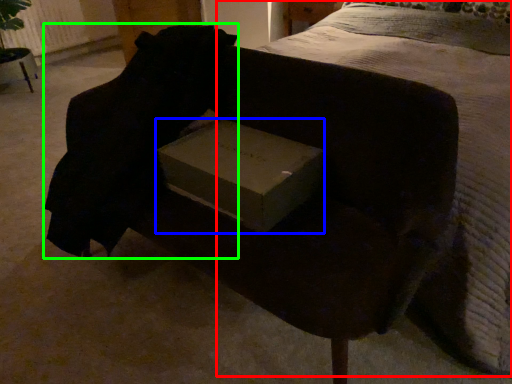
Question: Based on their relative distances, which object is farther from bed (highlighted by a red box)? Choose from box (highlighted by a blue box) and back (highlighted by a green box).

Choices:
 (A) box
 (B) back

Answer: (B)